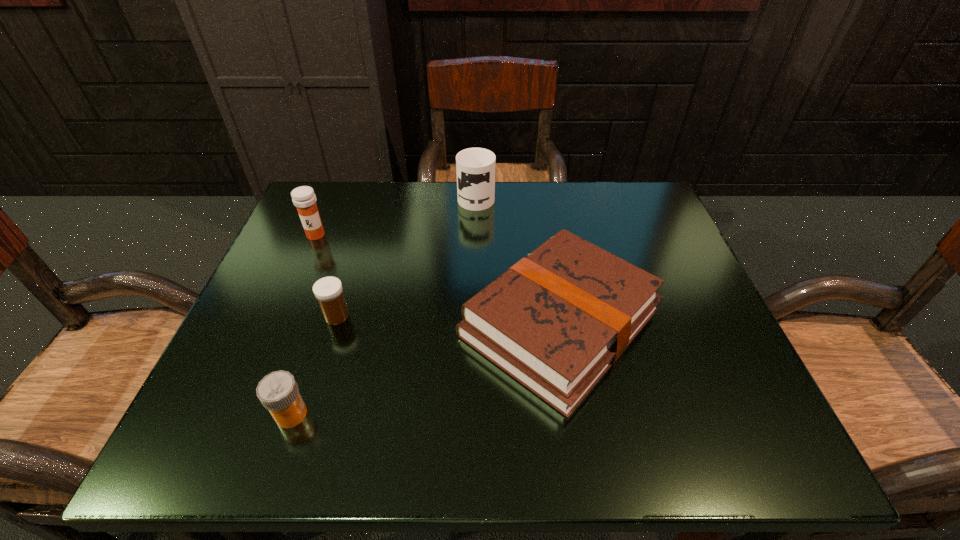
Image resolution: width=960 pixels, height=540 pixels. What are the coordinates of `free space in the image that satisfies the following two spatial constraints: 1. on the label side of the farthest medicine; 2. on the left side of the second nearest medicine` in the screenshot? It's located at (281, 316).

Identify the location of free space that satisfies the following two spatial constraints: 1. on the front side of the hardback book; 2. on the label side of the nearest medicine. (575, 414).